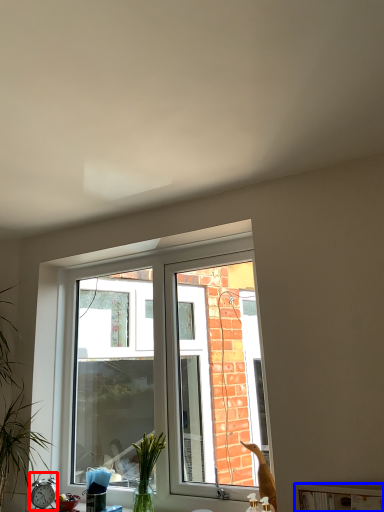
Question: Which of the following is the farthest to the observer, alarm clock (highlighted by a red box) or window sill (highlighted by a blue box)?

Choices:
 (A) alarm clock
 (B) window sill

Answer: (A)